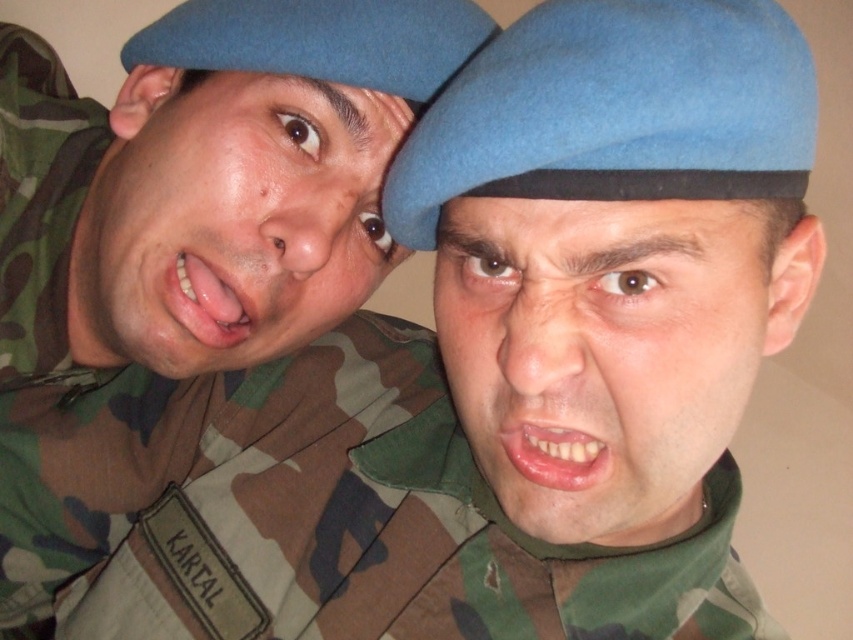
Does camo fabric uniform at left have a lesser width compared to pink glossy lips at center?

No.

Locate an element on the screen. camo fabric uniform at left is located at coordinates (164, 305).

Is point (281, 145) farther from viewer compared to point (531, 445)?

Yes, it is.

Does matte green uniform at left lie behind pink glossy lips at center?

Yes.

What do you see at coordinates (230, 218) in the screenshot? The width and height of the screenshot is (853, 640). I see `matte green uniform at left` at bounding box center [230, 218].

In order to click on matte green uniform at left in this screenshot , I will do `click(230, 218)`.

Who is more forward, (502, 250) or (158, 314)?

Positioned in front is point (502, 250).

Is point (608, 253) in front of point (206, 116)?

Yes, it is.

Where is `matte green face at center`? matte green face at center is located at coordinates (602, 353).